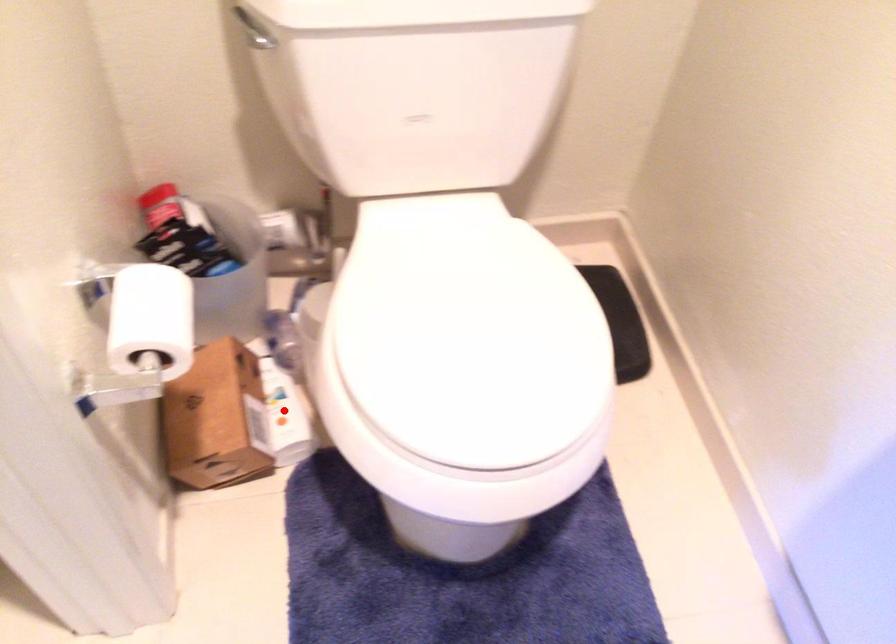
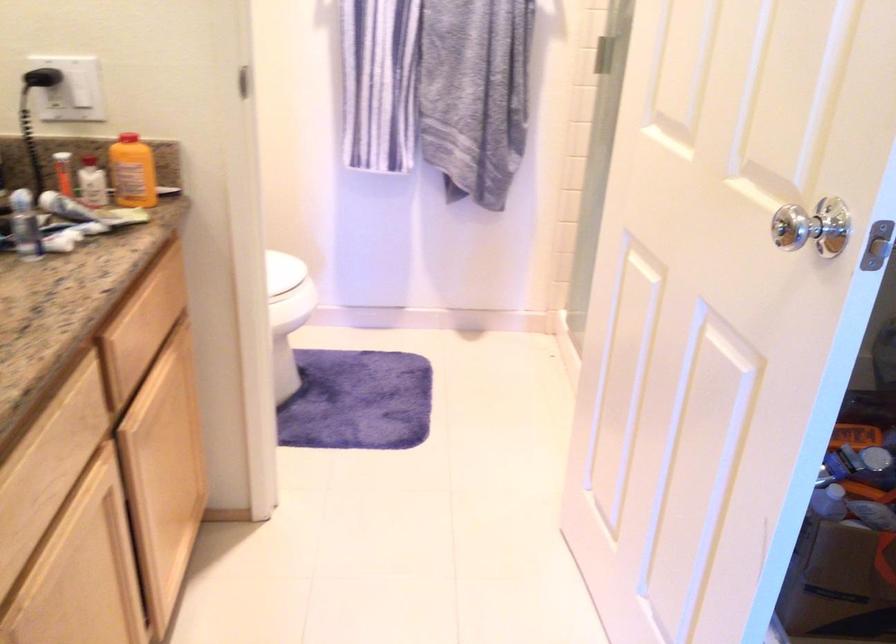
Question: I am providing you with two images of the same scene from different viewpoints. A red point is marked on the first image. At the location where the point appears in image 1, is it still visible in image 2?

Choices:
 (A) Yes
 (B) No

Answer: (B)